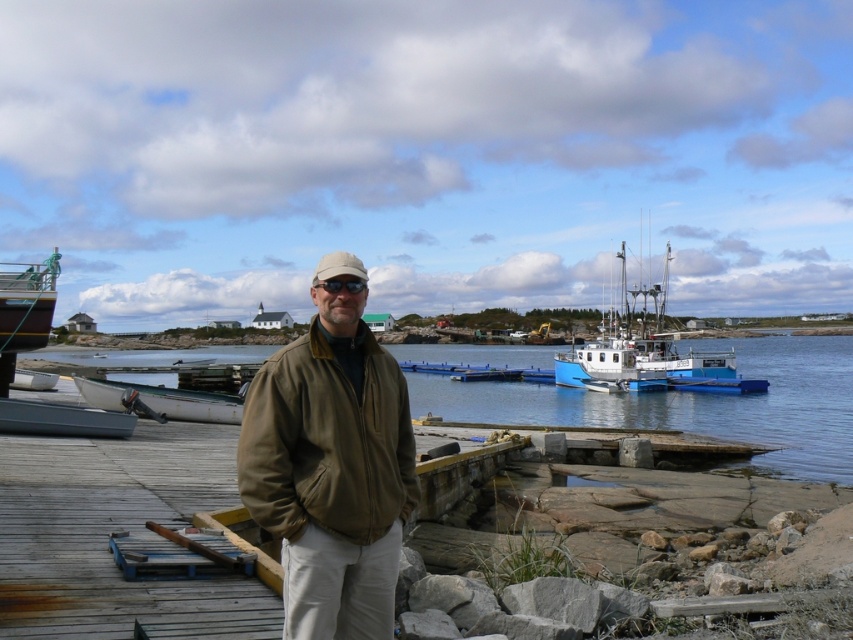
Does beige fabric baseball cap at center appear under black matte sunglasses at center?

No, beige fabric baseball cap at center is not below black matte sunglasses at center.

Who is more distant from viewer, [363,272] or [332,276]?

The point [363,272] is behind.

Where is `beige fabric baseball cap at center`? The width and height of the screenshot is (853, 640). beige fabric baseball cap at center is located at coordinates (338, 266).

In order to click on beige fabric baseball cap at center in this screenshot , I will do `click(338, 266)`.

Measure the distance from white matte boat at center to white matte boat at left.

The distance of white matte boat at center from white matte boat at left is 80.01 feet.

Is white matte boat at center bigger than white matte boat at left?

Correct, white matte boat at center is larger in size than white matte boat at left.

Between point (587, 355) and point (177, 410), which one is positioned in front?

Positioned in front is point (177, 410).

Locate an element on the screen. white matte boat at center is located at coordinates (648, 353).

Which is above, olive-green jacket at center or clear water at dock center?

olive-green jacket at center

Where is `olive-green jacket at center`? This screenshot has width=853, height=640. olive-green jacket at center is located at coordinates (331, 472).